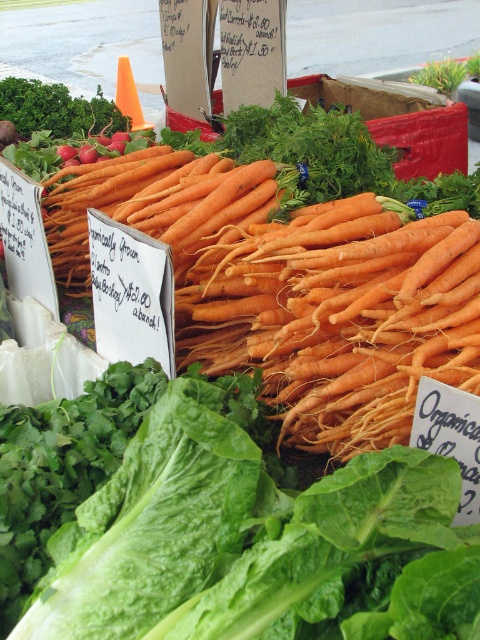
Question: Which of the following is the closest to the observer?

Choices:
 (A) (12, 109)
 (B) (319, 259)

Answer: (B)

Question: Which object appears farthest from the camera in this image?

Choices:
 (A) orange matte carrots at center
 (B) green leafy at upper left
 (C) green leafy at center

Answer: (B)

Question: Which of the following is the farthest from the observer?

Choices:
 (A) green leafy at upper left
 (B) orange matte carrots at center

Answer: (A)

Question: Can you confirm if green leafy at center is smaller than orange matte carrots at center?

Choices:
 (A) yes
 (B) no

Answer: (A)

Question: Can you confirm if green leafy at center is positioned to the right of orange matte carrots at center?

Choices:
 (A) yes
 (B) no

Answer: (B)

Question: Does orange matte carrots at center have a greater width compared to green leafy at upper left?

Choices:
 (A) no
 (B) yes

Answer: (B)